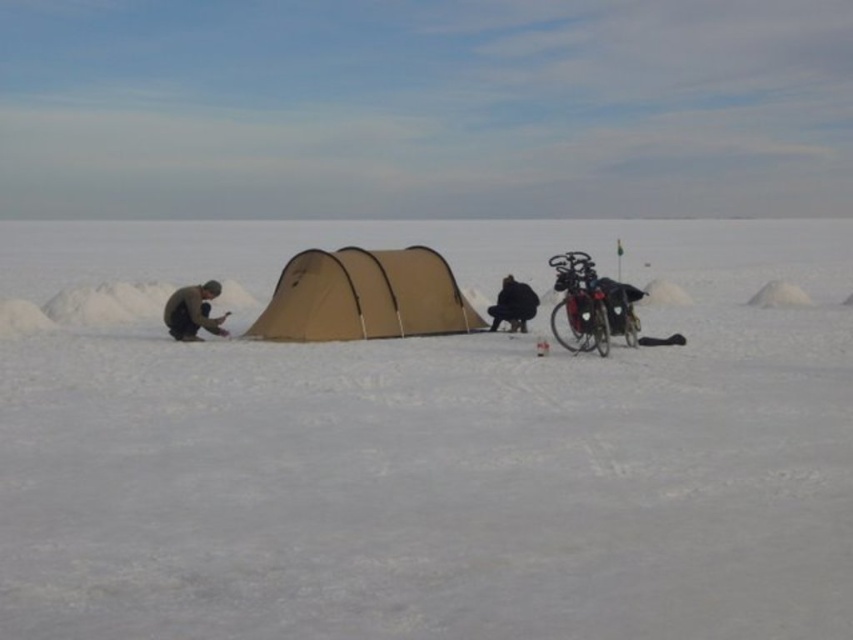
Is brown woolen sweater at left bigger than black fabric person at center?

Correct, brown woolen sweater at left is larger in size than black fabric person at center.

Does brown woolen sweater at left come in front of black fabric person at center?

Yes, it is.

Is point (212, 291) more distant than point (531, 305)?

No, it is in front of (531, 305).

Where is `brown woolen sweater at left`? Image resolution: width=853 pixels, height=640 pixels. brown woolen sweater at left is located at coordinates (192, 310).

Which is above, white matte snow at center or tan fabric tent at center?

Positioned higher is white matte snow at center.

Is the position of white matte snow at center less distant than that of tan fabric tent at center?

Yes, white matte snow at center is closer to the viewer.

Does point (310, 452) come in front of point (459, 314)?

That is True.

Where is `white matte snow at center`? white matte snow at center is located at coordinates (432, 449).

Does white matte snow at center have a greater width compared to brown woolen sweater at left?

Yes.

The image size is (853, 640). Find the location of `white matte snow at center`. white matte snow at center is located at coordinates (432, 449).